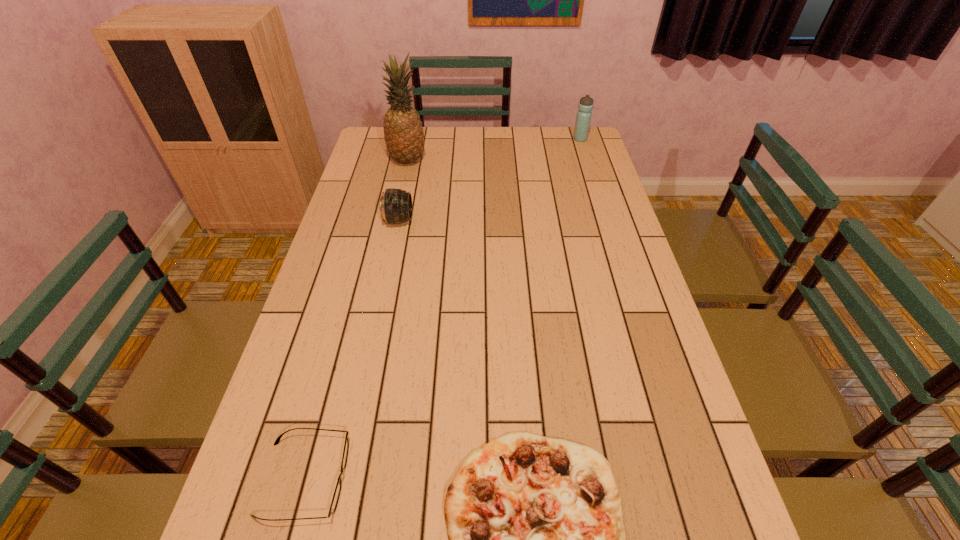
I want to click on the tallest object, so click(403, 132).

Image resolution: width=960 pixels, height=540 pixels. Identify the location of pineapple. (403, 132).

Locate an element on the screen. the farthest object is located at coordinates (583, 119).

Find the location of `the second tallest object`. the second tallest object is located at coordinates (583, 119).

Find the location of a particular element. The image size is (960, 540). telephoto lens is located at coordinates (395, 205).

The image size is (960, 540). Identify the location of the third tallest object. (395, 205).

This screenshot has width=960, height=540. What are the coordinates of `spectacles` in the screenshot? It's located at (335, 499).

I want to click on free space located 0.340m on the right of the second farthest object, so click(x=519, y=161).

Identify the location of vacant space situated on the front of the rightmost object. (590, 172).

I want to click on vacant space located 0.130m at the front element of the telephoto lens, so click(453, 220).